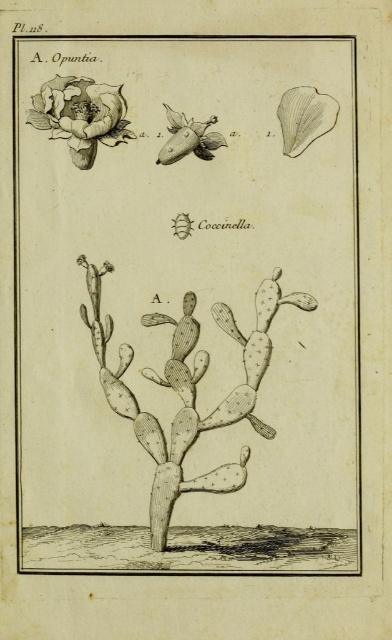
You are an art conservator examining the botanical illustration labeled Pl. 118. You notice two points marked in the image at coordinates point (243, 483) and point (210, 120). From your perspective, which point is closer to you?

Point (243, 483) is in front of point (210, 120), so it is closer to you.